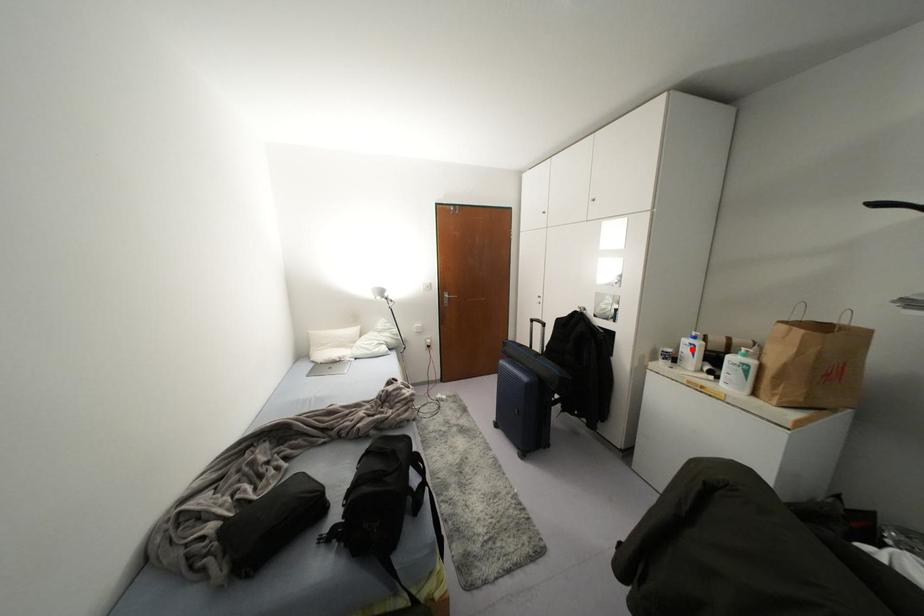
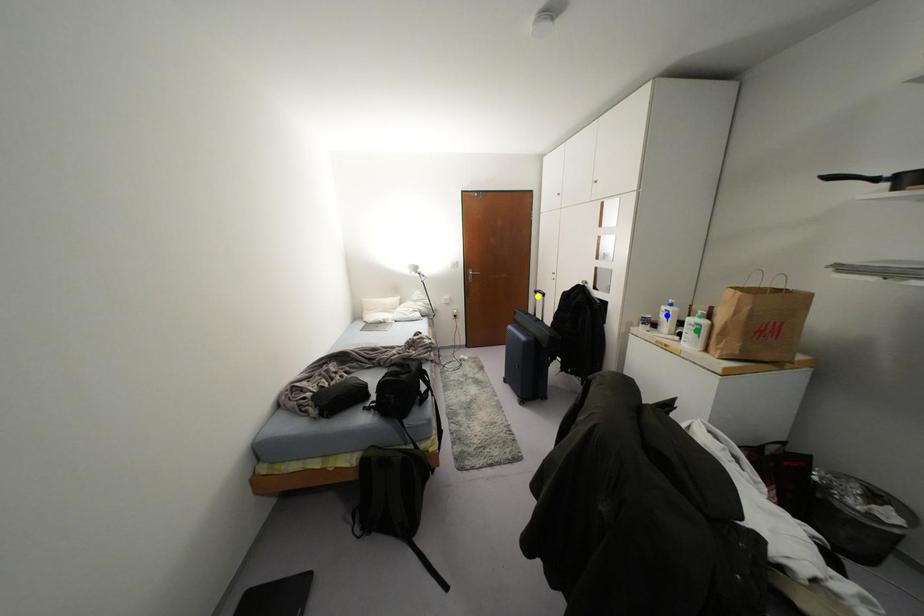
Question: I am providing you with two images of the same scene from different viewpoints. A red point is marked on the first image. You are given multiple points on the second image. Which spot in image 2 lines up with the point in image 1?

Choices:
 (A) yellow point
 (B) blue point
 (C) green point

Answer: (B)